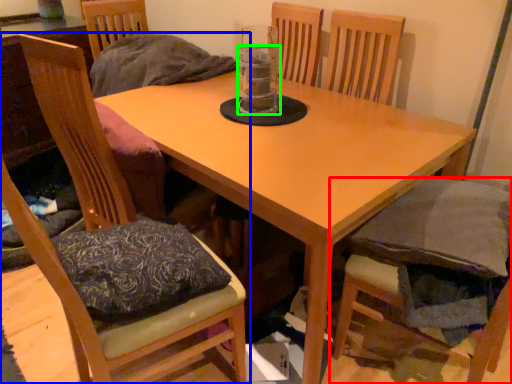
Question: Which is farther away from chair (highlighted by a red box)? chair (highlighted by a blue box) or beverage (highlighted by a green box)?

Choices:
 (A) chair
 (B) beverage

Answer: (A)